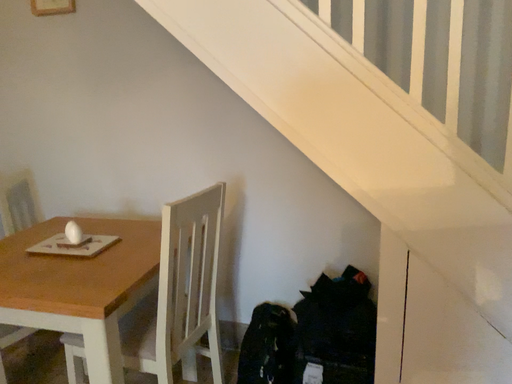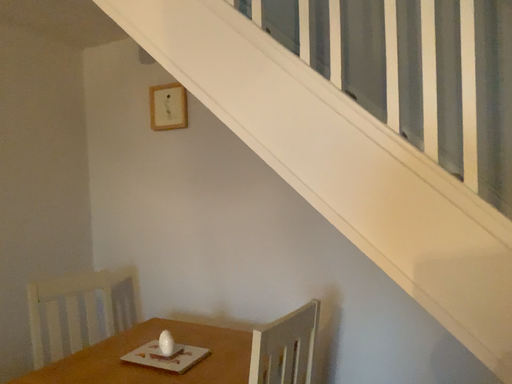
Question: How did the camera likely rotate when shooting the video?

Choices:
 (A) rotated upward
 (B) rotated downward

Answer: (A)